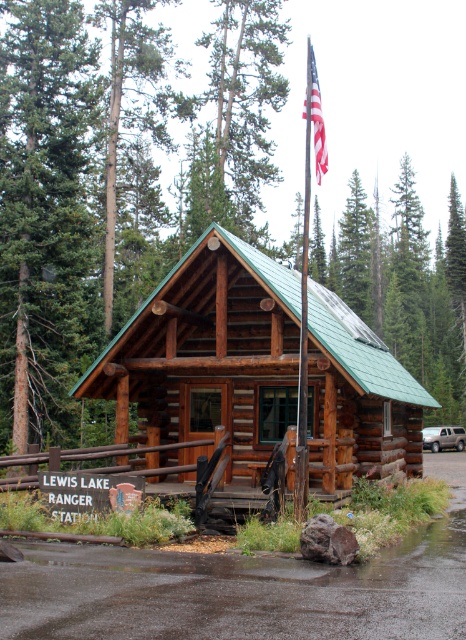
You are standing at the ranger station and want to locate two points marked in the image. The first point is at coordinate point[299,448] and the second is at point[446,445]. Which of these two points is closer to the ranger station?

Point[299,448] is in front of point[446,445], so it is closer to the ranger station.

You are a visitor arriving at the Lewis Lake Ranger Station and see the american flag at upper center and the satin silver suv at right. Which object is closer to the entrance of the cabin?

The american flag at upper center is closer to the entrance of the cabin because it is positioned on the left side of the satin silver suv at right, which would place it in front of the cabin where the entrance is located.